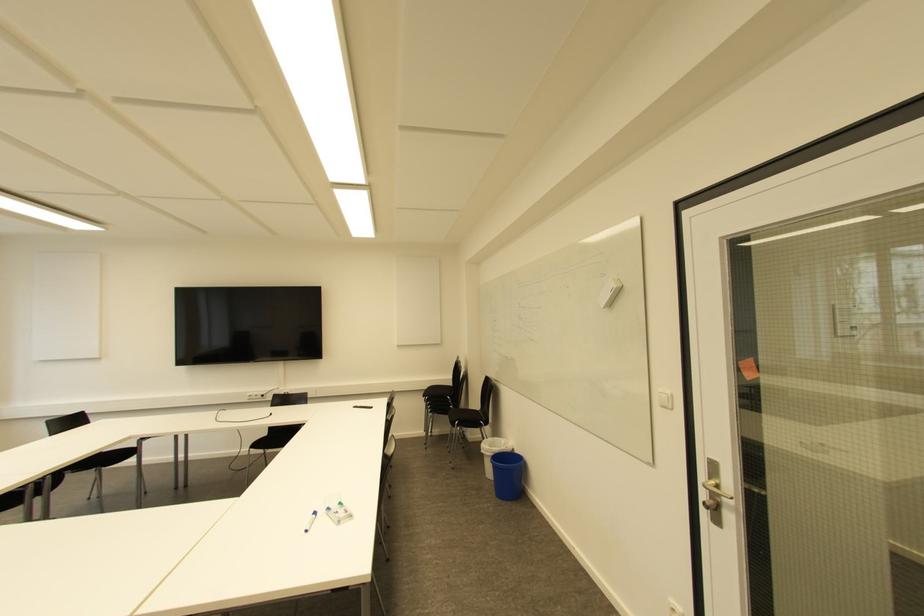
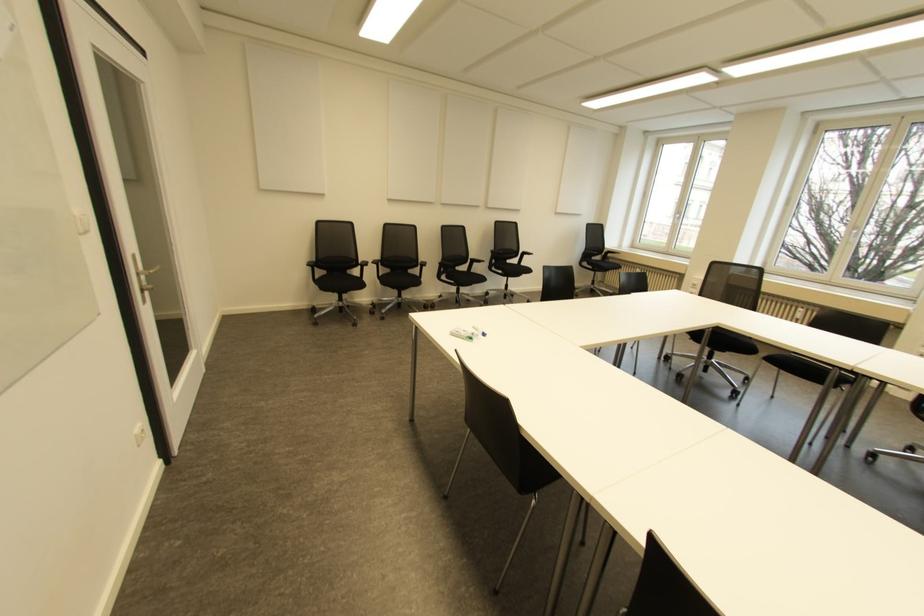
Find the pixel in the second image that matches (x=339, y=503) in the first image.

(470, 338)